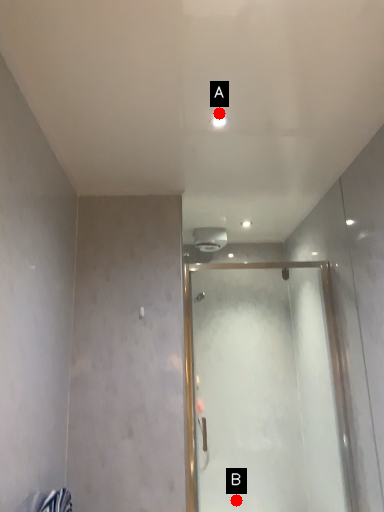
Question: Two points are circled on the image, labeled by A and B beside each circle. Which point is closer to the camera taking this photo?

Choices:
 (A) A is closer
 (B) B is closer

Answer: (A)